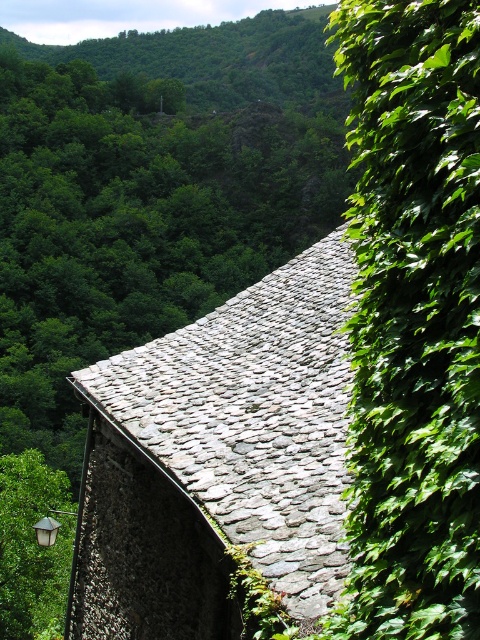
Question: Which point is closer to the camera?

Choices:
 (A) green leafy ivy at right
 (B) gray stone roof at upper center

Answer: (A)

Question: Which of these objects is positioned farthest from the green leafy tree at lower left?

Choices:
 (A) gray stone roof at upper center
 (B) green leafy ivy at right

Answer: (B)

Question: Does gray stone roof at upper center have a greater width compared to green leafy tree at lower left?

Choices:
 (A) no
 (B) yes

Answer: (A)

Question: Does green leafy ivy at right appear over green leafy tree at lower left?

Choices:
 (A) no
 (B) yes

Answer: (B)

Question: Is gray stone roof at upper center behind green leafy tree at lower left?

Choices:
 (A) yes
 (B) no

Answer: (B)

Question: Which of these objects is positioned closest to the green leafy tree at lower left?

Choices:
 (A) gray stone roof at upper center
 (B) green leafy ivy at right

Answer: (A)